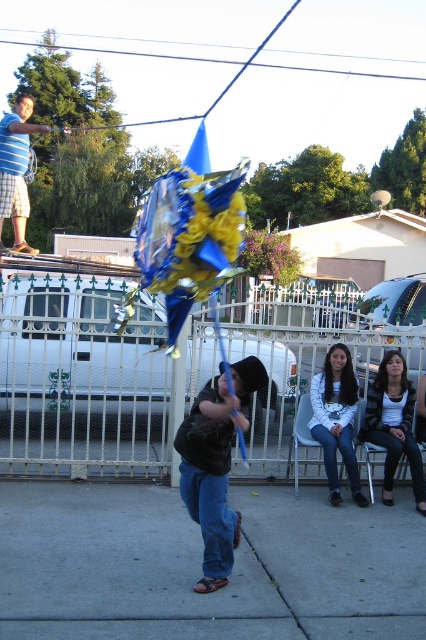
You are standing at the center of the scene and want to walk towards the point labeled as point (x=386, y=412). However, there is an obstacle at point (x=397, y=330). Will you encounter this obstacle before reaching your destination?

Since point (x=397, y=330) is behind point (x=386, y=412), you will not encounter the obstacle at point (x=397, y=330) before reaching your destination at point (x=386, y=412).

You are planning to place a 3 meter wide banner on the ground between the gray concrete pavement at center and the white metal fence at center. Based on the scene description, will the banner fit between them?

The gray concrete pavement at center has a width less than the white metal fence at center. Since the banner is 3 meters wide, it depends on the actual width of the fence. However, since the pavement is narrower than the fence, if the fence is wider than 3 meters, the banner can fit. Without exact measurements, we cannot confirm for sure.

You are a photographer at the event and want to capture a closeup of the striped sweater at lower right and denim jeans at lower right. Which one should you zoom in on to ensure it fills the frame better?

The striped sweater at lower right is bigger than denim jeans at lower right, so zooming in on the striped sweater at lower right will fill the frame better.